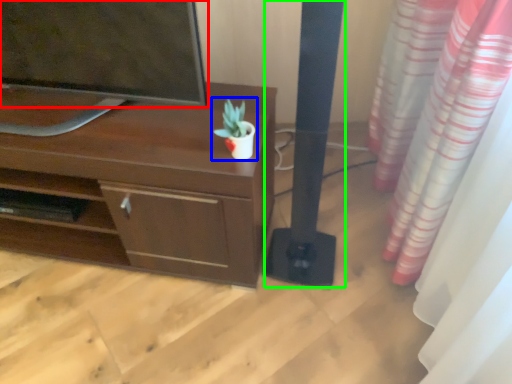
Question: Estimate the real-world distances between objects in this image. Which object is closer to television (highlighted by a red box), houseplant (highlighted by a blue box) or pillar (highlighted by a green box)?

Choices:
 (A) houseplant
 (B) pillar

Answer: (A)